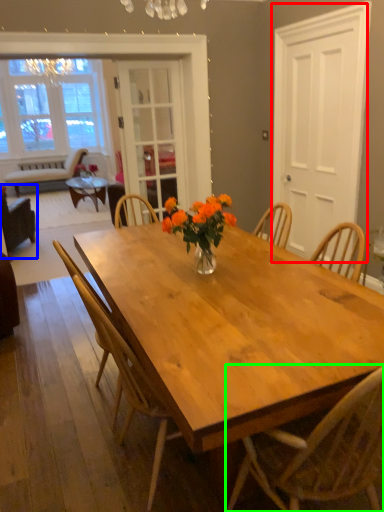
Question: Which object is the closest to the screen door (highlighted by a red box)? Choose among these: chair (highlighted by a blue box) or chair (highlighted by a green box).

Choices:
 (A) chair
 (B) chair

Answer: (B)